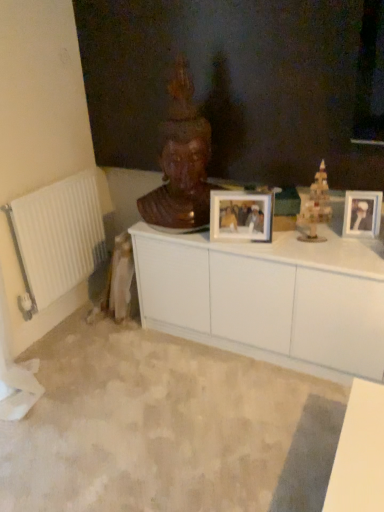
Where is `free region under white metal radiator at left (from a real-world perspective)`? Image resolution: width=384 pixels, height=512 pixels. free region under white metal radiator at left (from a real-world perspective) is located at coordinates (66, 322).